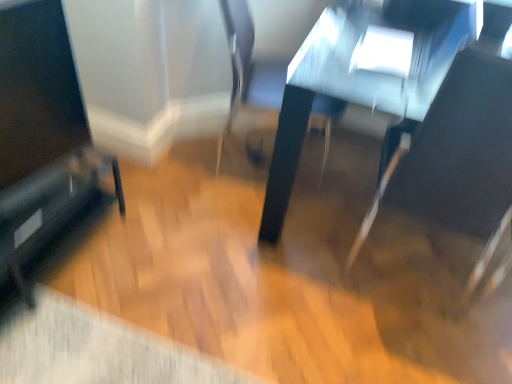
Question: Is black glossy speaker at lower left to the right of metallic silver swivel chair at center, which ranks as the second swivel chair in right-to-left order, from the viewer's perspective?

Choices:
 (A) yes
 (B) no

Answer: (B)

Question: Is metallic silver swivel chair at center, which ranks as the second swivel chair in right-to-left order, inside black glossy speaker at lower left?

Choices:
 (A) yes
 (B) no

Answer: (B)

Question: From the image's perspective, is black glossy speaker at lower left above metallic silver swivel chair at center, which ranks as the second swivel chair in right-to-left order?

Choices:
 (A) yes
 (B) no

Answer: (B)

Question: Is black glossy speaker at lower left smaller than metallic silver swivel chair at center, which ranks as the second swivel chair in right-to-left order?

Choices:
 (A) yes
 (B) no

Answer: (A)

Question: Is black glossy speaker at lower left turned away from metallic silver swivel chair at center, which appears as the first swivel chair when viewed from the left?

Choices:
 (A) yes
 (B) no

Answer: (B)

Question: Can you confirm if black glossy speaker at lower left is wider than metallic silver swivel chair at center, which appears as the first swivel chair when viewed from the left?

Choices:
 (A) yes
 (B) no

Answer: (B)

Question: Considering the relative positions of black glossy speaker at lower left and black glossy screen at left in the image provided, is black glossy speaker at lower left in front of black glossy screen at left?

Choices:
 (A) yes
 (B) no

Answer: (B)

Question: Does black glossy speaker at lower left have a greater height compared to black glossy screen at left?

Choices:
 (A) yes
 (B) no

Answer: (B)

Question: Does black glossy speaker at lower left have a lesser height compared to black glossy screen at left?

Choices:
 (A) no
 (B) yes

Answer: (B)

Question: Is black glossy speaker at lower left facing away from black glossy screen at left?

Choices:
 (A) yes
 (B) no

Answer: (B)

Question: From a real-world perspective, does black glossy speaker at lower left stand above black glossy screen at left?

Choices:
 (A) no
 (B) yes

Answer: (A)

Question: From the image's perspective, is black glossy speaker at lower left over black glossy screen at left?

Choices:
 (A) no
 (B) yes

Answer: (A)

Question: Does black leather swivel chair at right, which is counted as the 1th swivel chair, starting from the right, appear on the right side of shiny black table at center?

Choices:
 (A) yes
 (B) no

Answer: (B)